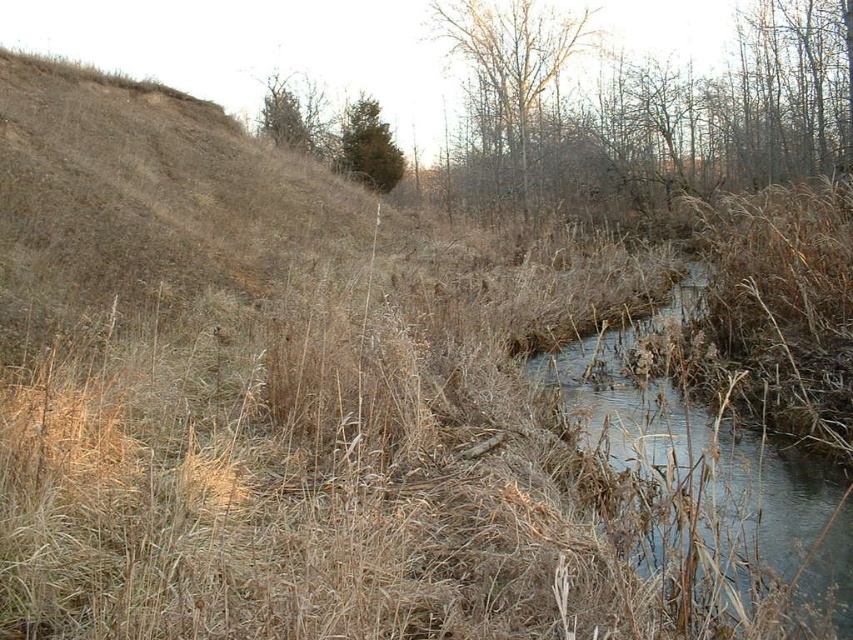
Question: Does bare branches at upper center lie behind green matte tree at upper center?

Choices:
 (A) no
 (B) yes

Answer: (A)

Question: Can you confirm if clear water at center is wider than green matte tree at upper center?

Choices:
 (A) no
 (B) yes

Answer: (B)

Question: Which point is farther to the camera?

Choices:
 (A) (769, 497)
 (B) (373, 168)

Answer: (B)

Question: Which of these objects is positioned closest to the brown leafless tree at upper center?

Choices:
 (A) green matte tree at upper center
 (B) bare branches at upper center
 (C) clear water at center

Answer: (B)

Question: Based on their relative distances, which object is farther from the brown leafless tree at upper center?

Choices:
 (A) green matte tree at upper center
 (B) bare branches at upper center
 (C) clear water at center

Answer: (C)

Question: Is brown leafless tree at upper center smaller than green matte tree at upper center?

Choices:
 (A) yes
 (B) no

Answer: (B)